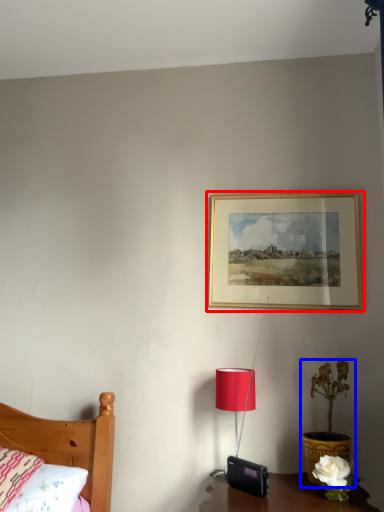
Question: Which of the following is the closest to the observer, picture frame (highlighted by a red box) or houseplant (highlighted by a blue box)?

Choices:
 (A) picture frame
 (B) houseplant

Answer: (B)